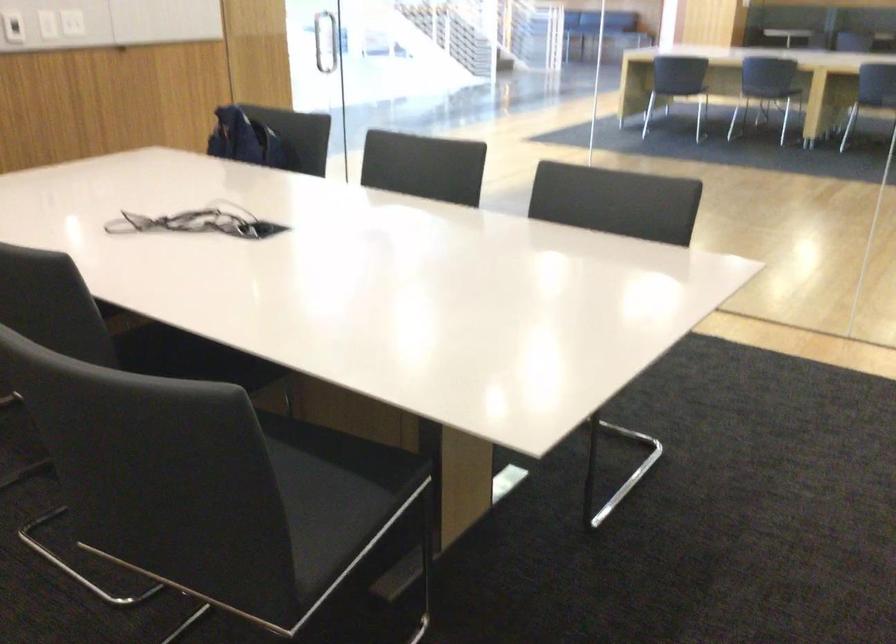
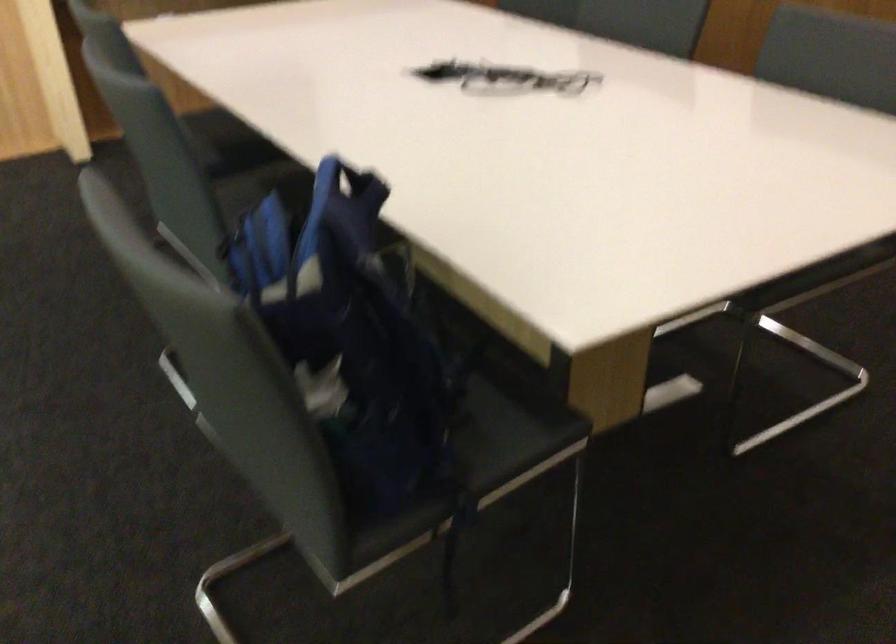
Where in the second image is the point corresponding to point (242, 115) from the first image?

(349, 184)